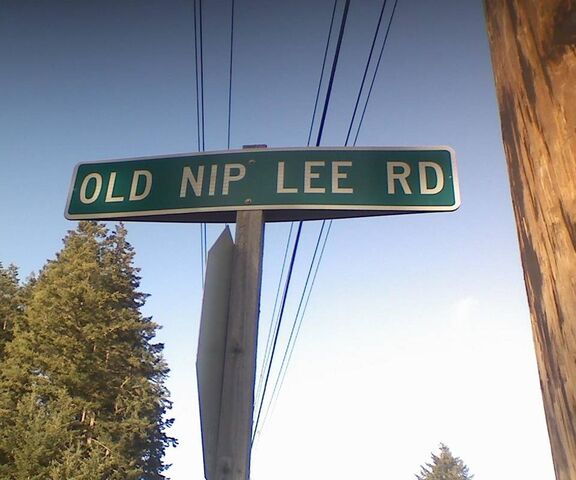
The width and height of the screenshot is (576, 480). In order to click on power cord in this screenshot , I will do `click(331, 88)`.